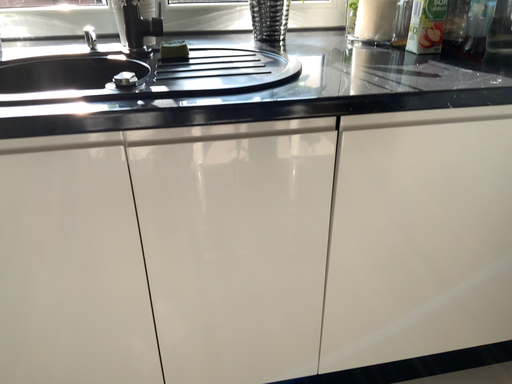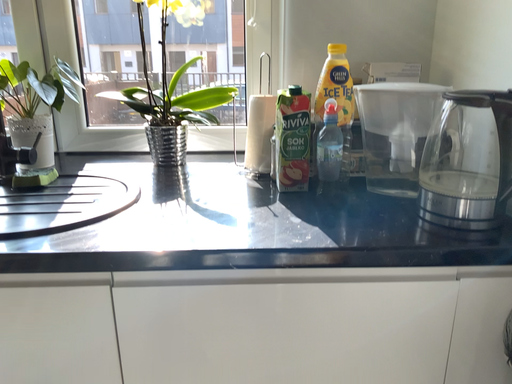
Question: Which way did the camera rotate in the video?

Choices:
 (A) rotated right
 (B) rotated left

Answer: (B)